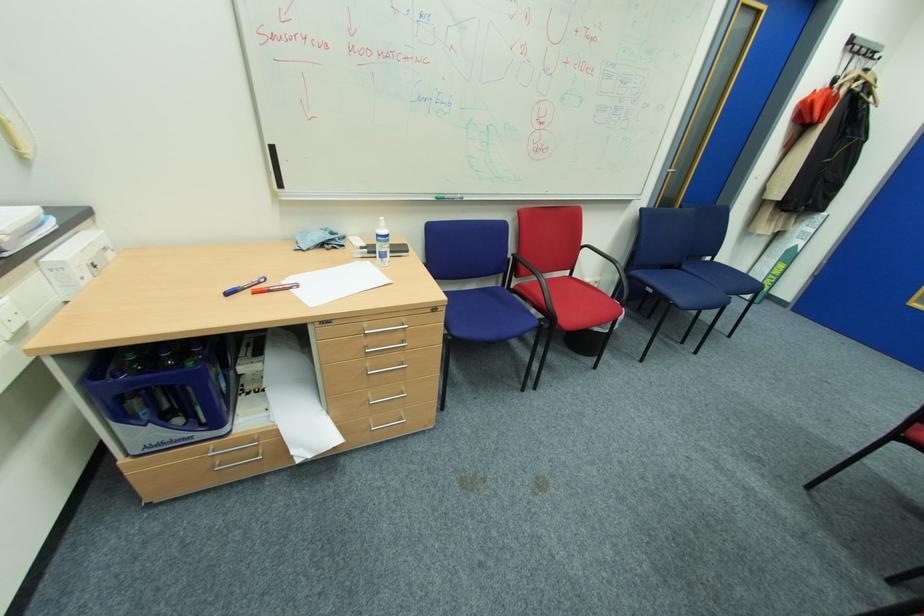
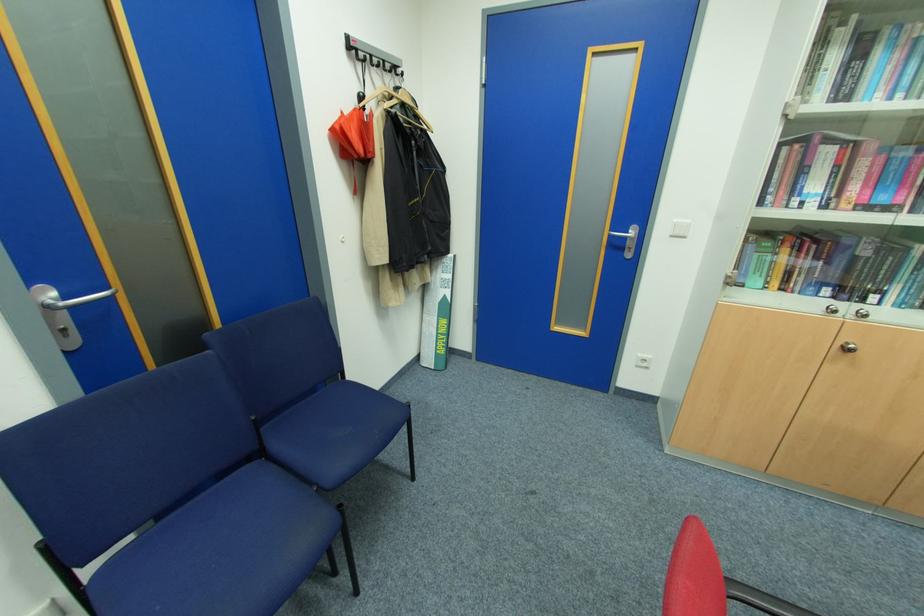
In the second image, find the point that corresponds to the point at 868,51 in the first image.

(380, 60)